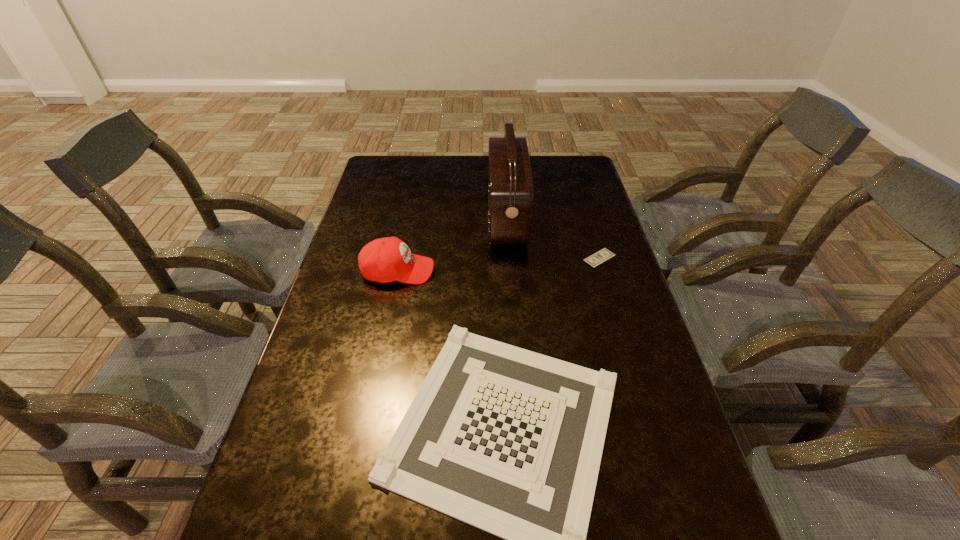
At what (x,y) coordinates should I click in order to perform the action: click on vacant space at the far edge of the desktop. Please return your answer as a coordinate pair (x, y). This screenshot has width=960, height=540. Looking at the image, I should click on (542, 176).

You are a GUI agent. You are given a task and a screenshot of the screen. Output one action in this format:
    pyautogui.click(x=<x>, y=<y>)
    Task: Click on the free region at the left edge of the desktop
    The width and height of the screenshot is (960, 540).
    Given the screenshot: What is the action you would take?
    pyautogui.click(x=336, y=289)

At what (x,y) coordinates should I click in order to perform the action: click on vacant space at the right edge of the desktop. Please return your answer as a coordinate pair (x, y). This screenshot has height=540, width=960. Looking at the image, I should click on (568, 216).

You are a GUI agent. You are given a task and a screenshot of the screen. Output one action in this format:
    pyautogui.click(x=<x>, y=<y>)
    Task: Click on the vacant point located between the baseball cap and the tallest object
    
    Given the screenshot: What is the action you would take?
    pyautogui.click(x=452, y=245)

The width and height of the screenshot is (960, 540). I want to click on free space between the radio receiver and the second tallest object, so click(x=452, y=245).

Locate an element on the screen. This screenshot has width=960, height=540. free area in between the radio receiver and the money is located at coordinates (553, 239).

Find the location of `empty location between the tallest object and the baseball cap`. empty location between the tallest object and the baseball cap is located at coordinates (452, 245).

Where is `vacant area that lies between the tallest object and the third shortest object`? vacant area that lies between the tallest object and the third shortest object is located at coordinates (452, 245).

Identify the location of free spot between the tallest object and the money. (553, 239).

The height and width of the screenshot is (540, 960). What are the coordinates of `empty space that is in between the money and the radio receiver` in the screenshot? It's located at (553, 239).